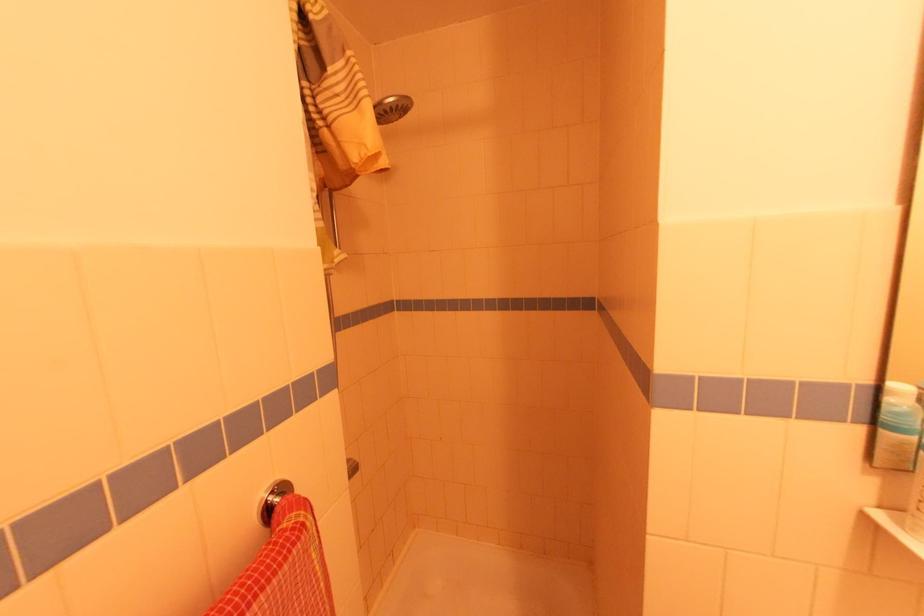
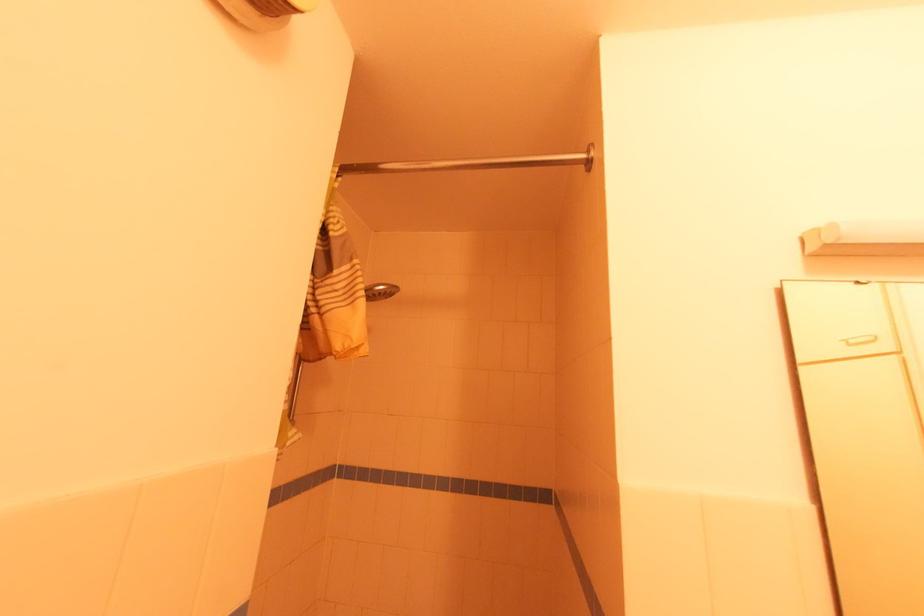
Question: Based on the continuous images, in which direction is the camera rotating? Reply with the corresponding letter.

Choices:
 (A) Left
 (B) Right
 (C) Up
 (D) Down

Answer: (C)